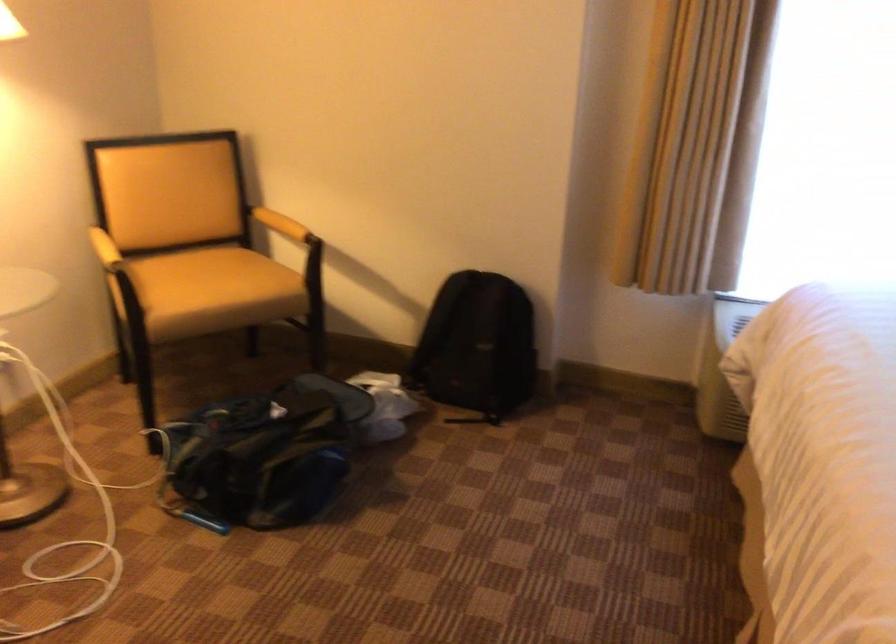
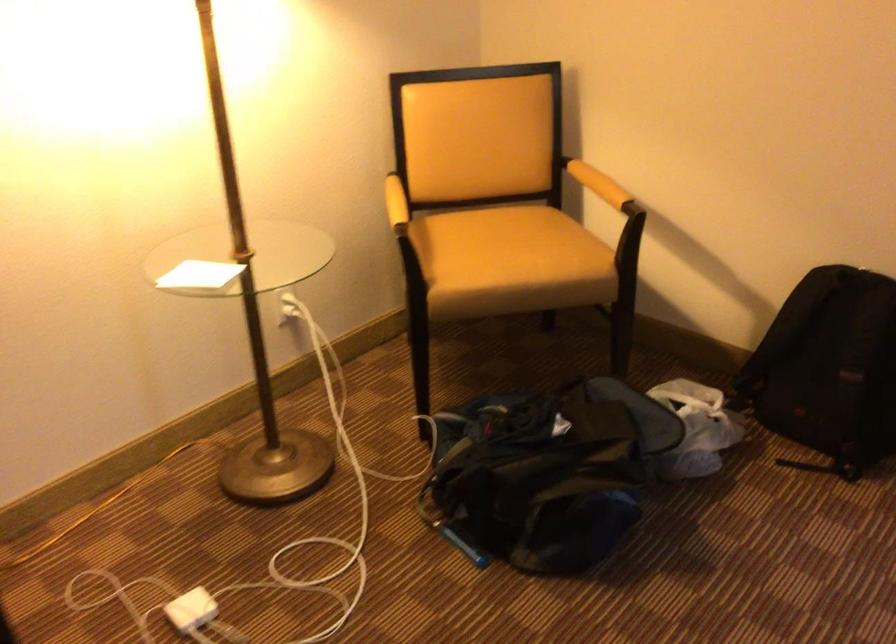
Locate, in the second image, the point that corresponds to the point at 263,451 in the first image.

(537, 480)